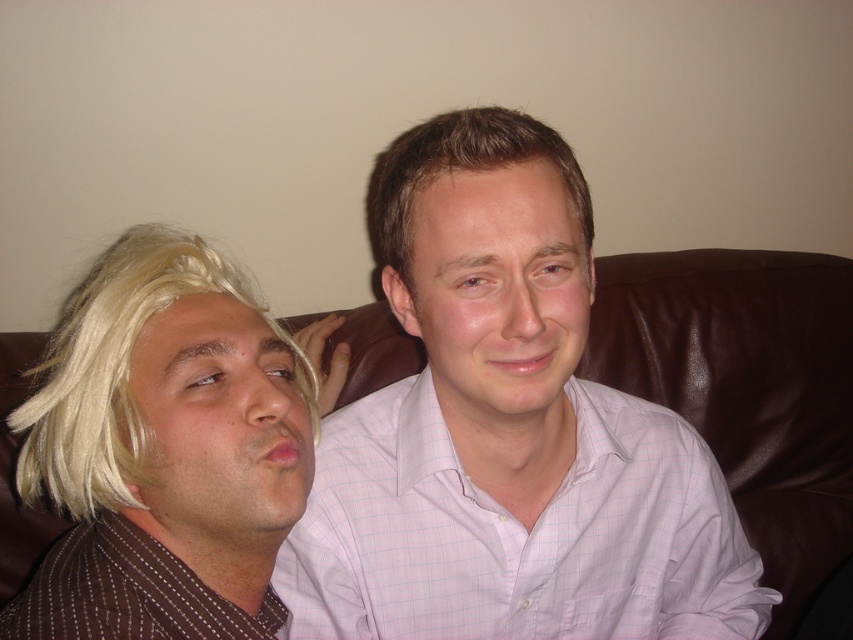
You are designing a living room layout and want to place a decorative shelf on the wall behind the brown leather couch at center. Considering the space occupied by the brown smooth hair at center, can the shelf be placed directly behind the couch without overlapping?

The brown leather couch at center is wider than brown smooth hair at center, so the shelf can be placed directly behind the couch without overlapping as the couch is wider and the hair is part of the person sitting on it.

You are an interior designer assessing the living room layout. You need to determine if the pink checkered shirt at center can be placed on the brown leather couch at center without overlapping. Based on their sizes, is this possible?

The pink checkered shirt at center is smaller than the brown leather couch at center, so it can be placed on the couch without overlapping.

You are an interior designer assessing the seating arrangement in the image. The two people are sitting on a couch. You need to determine if the pink checkered shirt at center will cover the brown smooth hair at center when viewed from the front. Based on their positions and sizes, what do you conclude?

The pink checkered shirt at center is taller than brown smooth hair at center, so the pink checkered shirt at center will cover the brown smooth hair at center when viewed from the front.